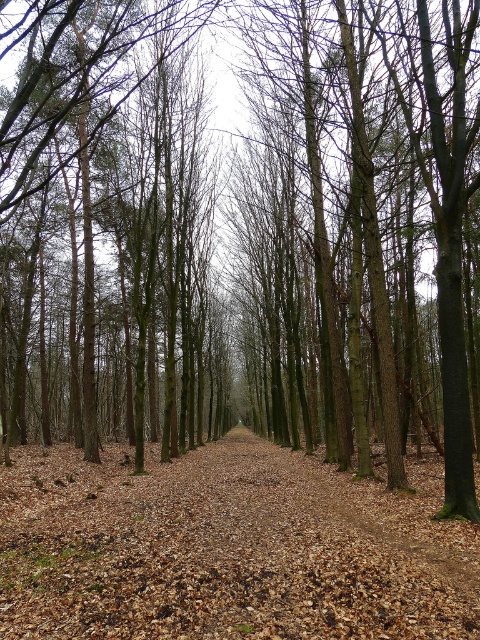
Question: Is brown leafy trail at center bigger than brown smooth tree at center?

Choices:
 (A) yes
 (B) no

Answer: (B)

Question: Considering the relative positions of brown leafy trail at center and brown smooth tree at center in the image provided, where is brown leafy trail at center located with respect to brown smooth tree at center?

Choices:
 (A) left
 (B) right

Answer: (B)

Question: Which point is closer to the camera?

Choices:
 (A) (83, 129)
 (B) (134, 532)

Answer: (B)

Question: Observing the image, what is the correct spatial positioning of brown leafy trail at center in reference to brown smooth tree at center?

Choices:
 (A) left
 (B) right

Answer: (B)

Question: Which of the following is the closest to the observer?

Choices:
 (A) (79, 28)
 (B) (165, 621)

Answer: (B)